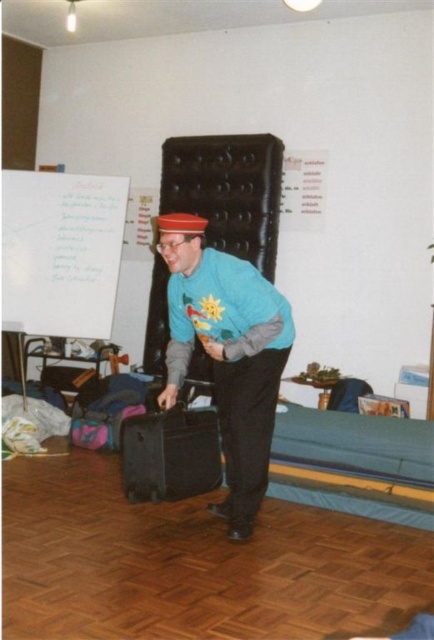
You are organizing a meeting in the room and need to place a new whiteboard marker. The white paper at upper left and the black hard suitcase at center are in your way. Which object should you move to access the area behind them?

You should move the white paper at upper left because it is positioned on the left side of the black hard suitcase at center, so moving it first would allow access to the area behind both objects.